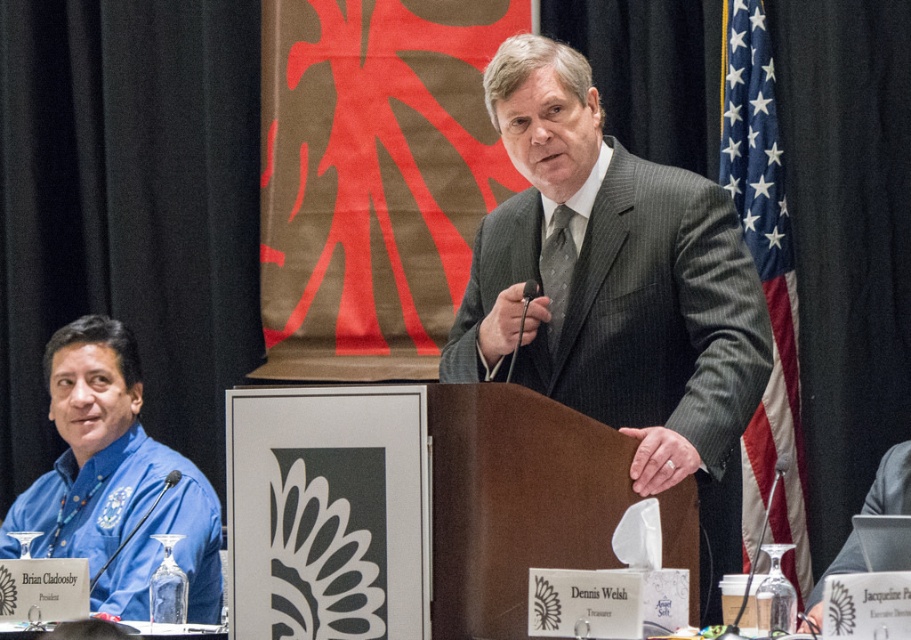
Describe the element at coordinates (115, 481) in the screenshot. The height and width of the screenshot is (640, 911). I see `blue fabric shirt at left` at that location.

Between blue fabric shirt at left and american flag at right, which one is positioned lower?

blue fabric shirt at left

Which is behind, point (96, 547) or point (724, 68)?

Positioned behind is point (724, 68).

This screenshot has height=640, width=911. I want to click on blue fabric shirt at left, so point(115,481).

Is point (67, 356) farther from viewer compared to point (551, 292)?

Yes.

Is blue fabric shirt at left closer to camera compared to pinstriped fabric tie at center?

No.

Is point (104, 396) positioned in front of point (564, 308)?

That is False.

Identify the location of blue fabric shirt at left. The image size is (911, 640). (115, 481).

Can you confirm if gray pinstripe suit at center is taller than pinstriped fabric tie at center?

Correct, gray pinstripe suit at center is much taller as pinstriped fabric tie at center.

From the picture: Is gray pinstripe suit at center to the right of pinstriped fabric tie at center from the viewer's perspective?

Yes, gray pinstripe suit at center is to the right of pinstriped fabric tie at center.

Which is in front, point (720, 192) or point (558, 257)?

Point (720, 192)

Image resolution: width=911 pixels, height=640 pixels. Identify the location of gray pinstripe suit at center. (613, 278).